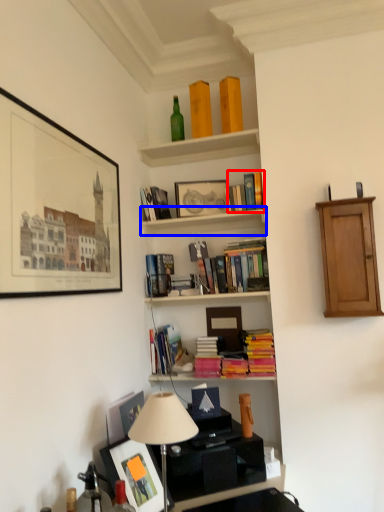
Question: Among these objects, which one is nearest to the camera, book (highlighted by a red box) or shelf (highlighted by a blue box)?

Choices:
 (A) book
 (B) shelf

Answer: (B)